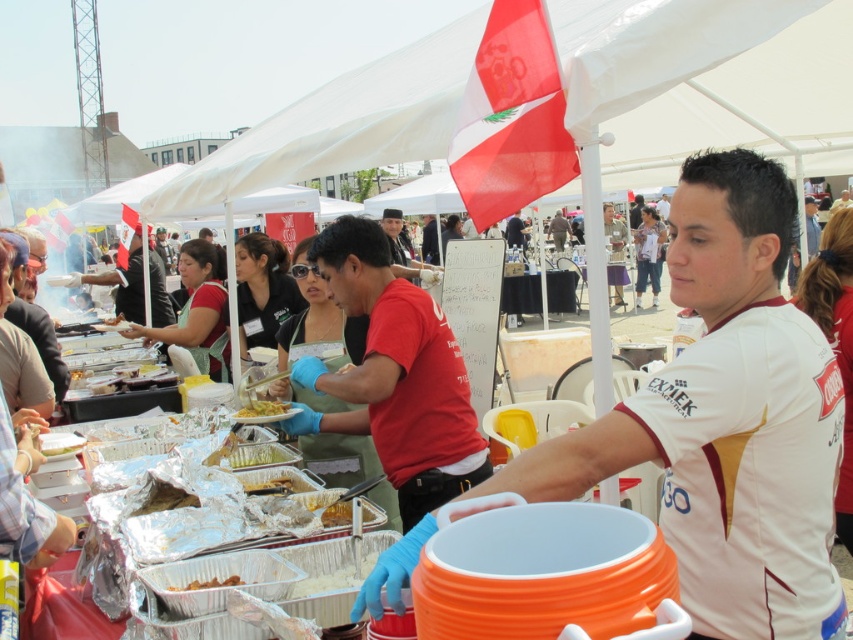
Question: Which point is farther to the camera?

Choices:
 (A) (221, 579)
 (B) (276, 410)
 (C) (286, 484)
 (D) (428, 227)

Answer: (D)

Question: Which point appears farthest from the camera in this image?

Choices:
 (A) (230, 467)
 (B) (234, 582)
 (C) (340, 518)
 (D) (787, 440)

Answer: (A)

Question: Is white jersey at center bigger than red matte shirt at center?

Choices:
 (A) yes
 (B) no

Answer: (B)

Question: Does red matte shirt at center appear on the left side of red shirt at center?

Choices:
 (A) no
 (B) yes

Answer: (B)

Question: Which is farther from the green matte food at center?

Choices:
 (A) golden brown rice at center
 (B) white jersey at center
 (C) red matte shirt at center
 (D) red shirt at center

Answer: (D)

Question: Is white jersey at center wider than green matte food at center?

Choices:
 (A) yes
 (B) no

Answer: (A)